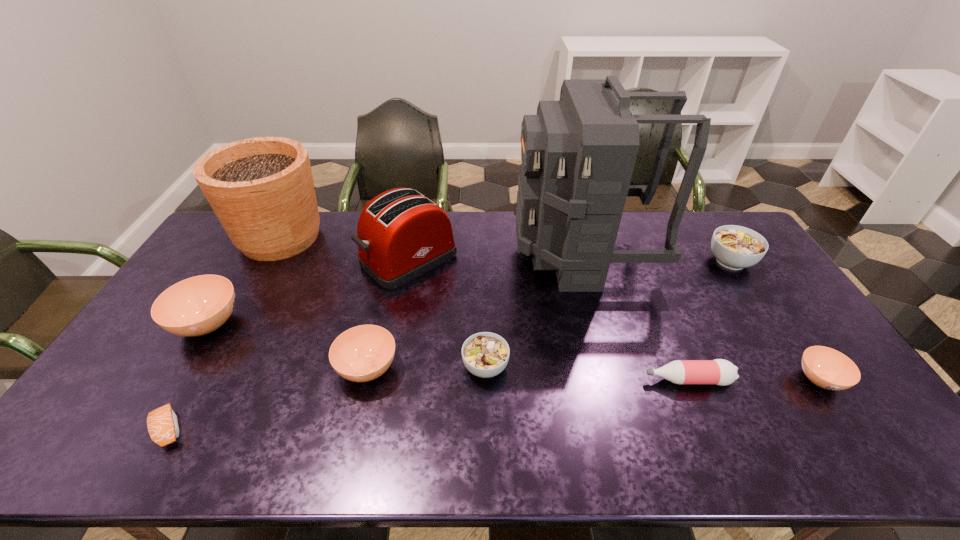
Image resolution: width=960 pixels, height=540 pixels. What are the coordinates of `object at the far right corner` in the screenshot? It's located at (735, 247).

I want to click on free space at the far edge of the desktop, so click(630, 235).

You are a GUI agent. You are given a task and a screenshot of the screen. Output one action in this format:
    pyautogui.click(x=<x>, y=<y>)
    Task: Click on the free spot at the right edge of the desktop
    
    Given the screenshot: What is the action you would take?
    pyautogui.click(x=747, y=268)

At what (x,y) coordinates should I click in order to perform the action: click on free spot between the rightmost peach soup bowl and the bottle. Please return your answer as a coordinate pair (x, y). This screenshot has height=540, width=960. Looking at the image, I should click on (754, 380).

Identify the location of free space between the bottle and the leftmost peach soup bowl. The width and height of the screenshot is (960, 540). (447, 352).

The width and height of the screenshot is (960, 540). Find the location of `free space between the leftmost peach soup bowl and the fourth soup bowl from right to left`. free space between the leftmost peach soup bowl and the fourth soup bowl from right to left is located at coordinates (288, 346).

This screenshot has width=960, height=540. What are the coordinates of `empty space between the pink bottle and the right white soup bowl` in the screenshot? It's located at (708, 321).

At what (x,y) coordinates should I click in order to perform the action: click on vacant space that is in between the red toaster and the fourth soup bowl from right to left. Please return your answer as a coordinate pair (x, y). This screenshot has width=960, height=540. Looking at the image, I should click on (388, 314).

I want to click on vacant region between the sushi and the ninth shortest object, so click(225, 333).

Locate an element on the screen. This screenshot has width=960, height=540. empty location between the bottle and the second tallest object is located at coordinates (484, 309).